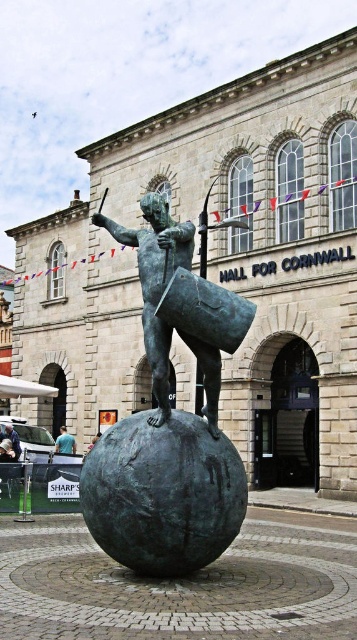
You are a photographer standing in front of the Hall for Cornwall. You want to take a photo of the light blue shirt at center without the bronze statue at center blocking it. Is the statue wider than the shirt?

The bronze statue at center might be wider than light blue shirt at center, so there is a possibility that the statue could block the shirt in the photo.

You are a photographer planning to capture both the bronze statue at center and the light blue jeans at lower left in a single frame. Based on their sizes, which object should you position closer to the camera to ensure both are visible clearly?

Since the bronze statue at center is wider than the light blue jeans at lower left, you should position the bronze statue at center closer to the camera. This way, its larger size will be better accommodated within the frame, allowing both objects to be visible clearly.